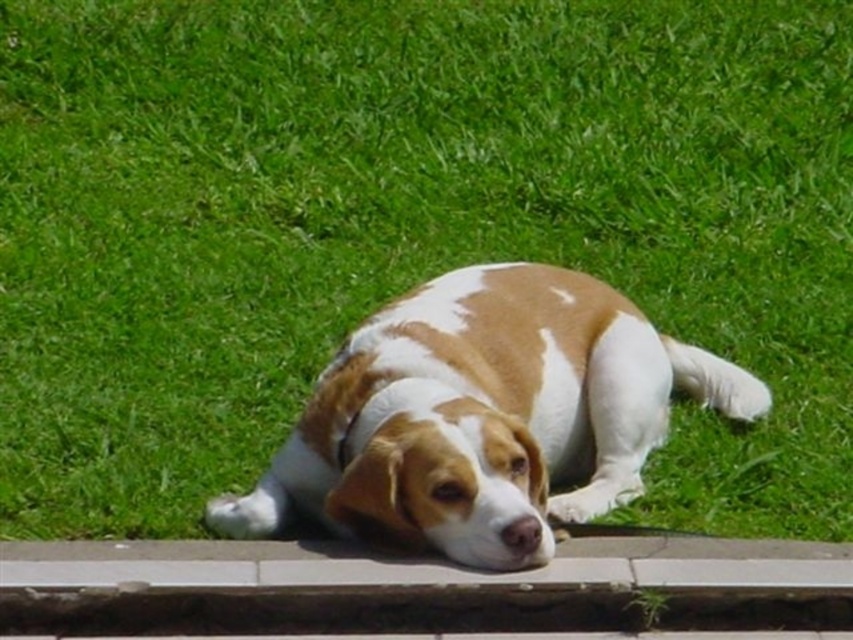
Consider the image. You are standing in the scene and want to walk from point (573, 516) to point (345, 570). Which direction should you move relative to the dog?

Since point (573, 516) is further to the camera than point (345, 570), you should move towards the dog to reach point (345, 570).

Consider the image. You are a photographer trying to capture the brown and white fur dog at center and the gray concrete curb at lower center in a single shot. Based on their positions, can you determine if the dog is lying on the curb or just near it?

The brown and white fur dog at center is positioned over gray concrete curb at lower center, so the dog is lying on the curb.

You are a photographer trying to capture a photo of the brown and white fur dog at center and the gray concrete curb at lower center. Based on their positions, which object is closer to the camera?

The brown and white fur dog at center is closer to the camera because it is in front of the gray concrete curb at lower center.